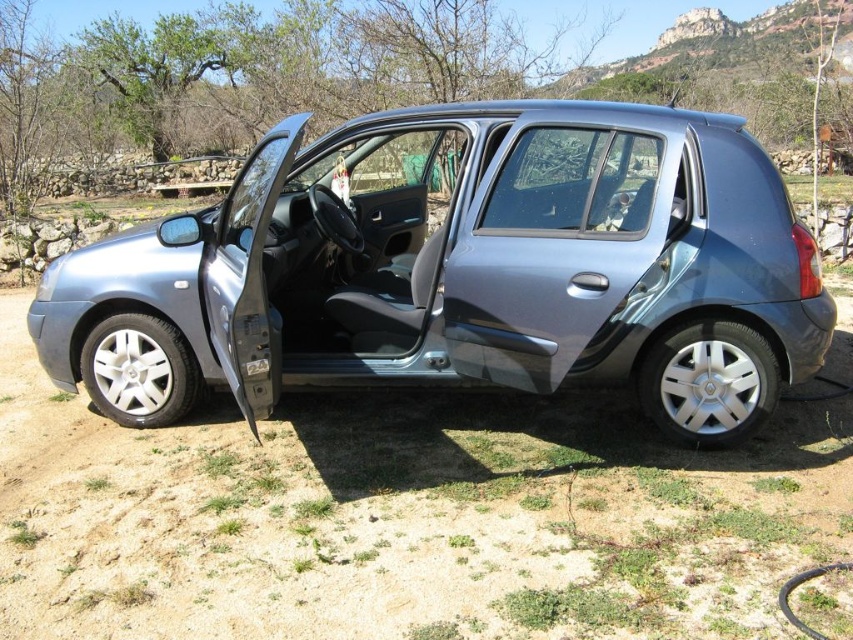
You are a photographer trying to capture the satin metallic car at center and the satin metallic car door at center. Which object should you focus on first if you want to ensure both are in sharp focus?

The satin metallic car at center is closer to you than the satin metallic car door at center, so focus on the satin metallic car at center first to ensure both are in sharp focus.

Consider the image. You are standing at the origin point of the coordinate system where the car is at point (x=461, y=268). If you want to walk directly towards the car, which direction should you move?

Since the car is located at point (x=461, y=268) in the coordinate system, you should move towards the northeast direction to reach it.

You are a delivery person trying to load a package into the back of the satin metallic car at center. The package is 1.2 meters tall. Can you fit it vertically inside the satin metallic car door at center?

The satin metallic car at center is taller than the satin metallic car door at center. Since the car itself is taller than the door, the door opening might not be tall enough to accommodate a 1.2 meter tall package vertically. You may need to check the door height or consider placing the package horizontally.